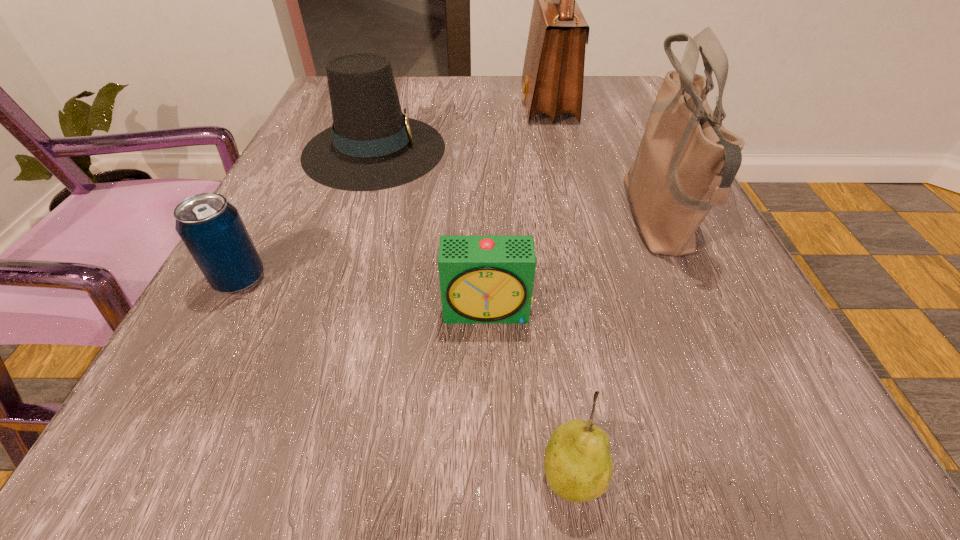
At what (x,y) coordinates should I click in order to perform the action: click on the left shoulder bag. Please return your answer as a coordinate pair (x, y). Looking at the image, I should click on (553, 72).

The height and width of the screenshot is (540, 960). What are the coordinates of `the right shoulder bag` in the screenshot? It's located at (686, 162).

This screenshot has height=540, width=960. I want to click on the rightmost object, so click(x=686, y=162).

Where is `the fourth shortest object`? Image resolution: width=960 pixels, height=540 pixels. the fourth shortest object is located at coordinates point(372,145).

What are the coordinates of `soda can` in the screenshot? It's located at (211, 228).

This screenshot has height=540, width=960. In order to click on alarm clock in this screenshot , I will do `click(483, 279)`.

Identify the location of the nearest object. (578, 465).

What are the coordinates of `vacant space located 0.100m on the front flap of the left shoulder bag` in the screenshot? It's located at (478, 103).

Locate an element on the screen. This screenshot has width=960, height=540. blank space located 0.350m on the front flap of the left shoulder bag is located at coordinates (371, 103).

Image resolution: width=960 pixels, height=540 pixels. What are the coordinates of `free space located 0.090m on the front flap of the left shoulder bag` in the screenshot? It's located at (483, 103).